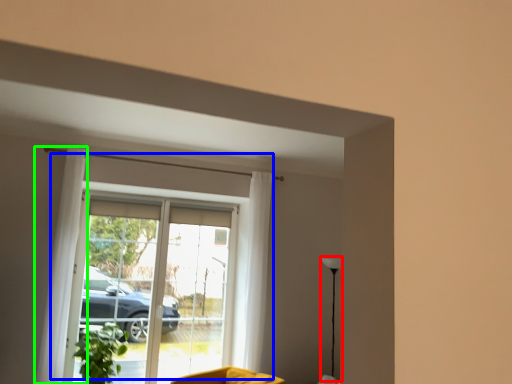
Question: Which is farther away from lamp (highlighted by a red box)? window (highlighted by a blue box) or curtain (highlighted by a green box)?

Choices:
 (A) window
 (B) curtain

Answer: (B)